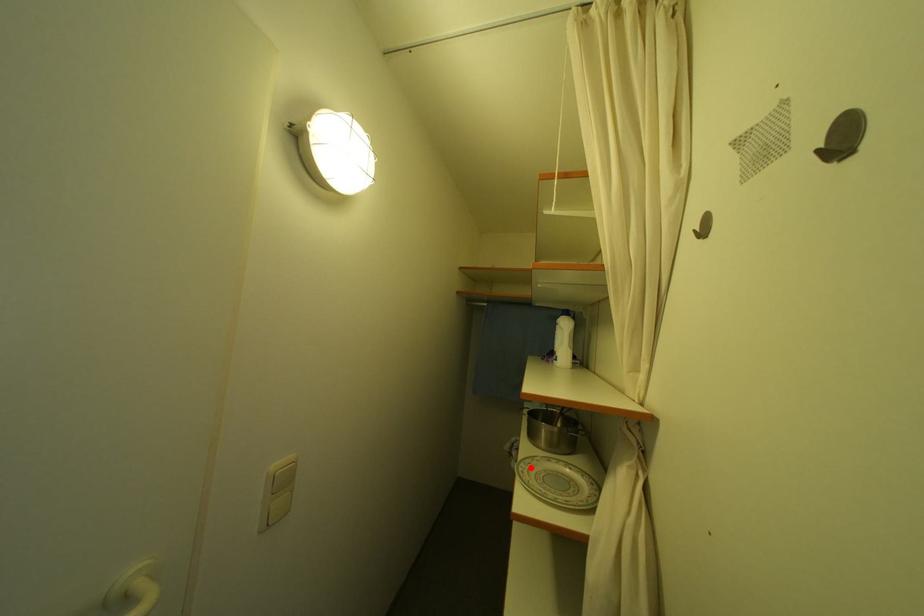
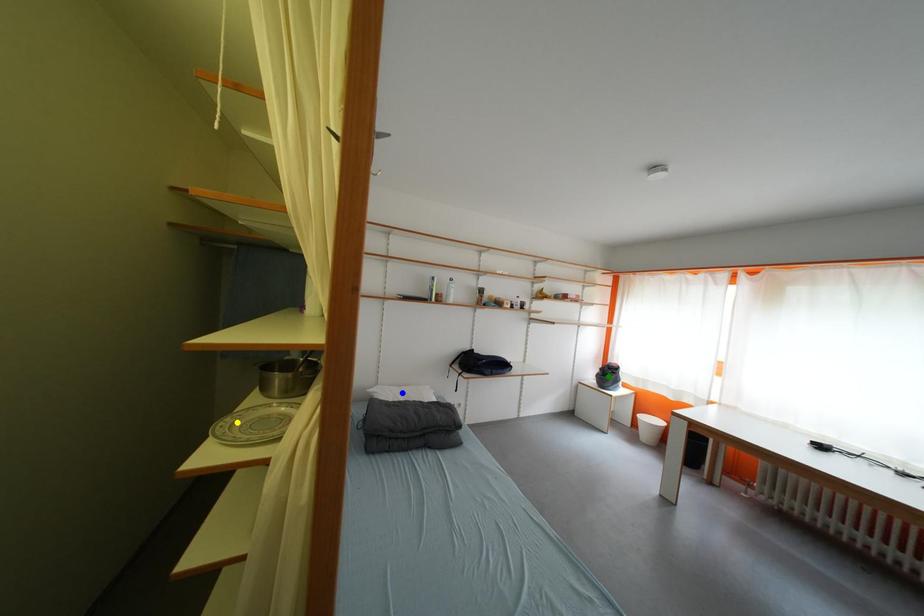
Question: I am providing you with two images of the same scene from different viewpoints. A red point is marked on the first image. You are given multiple points on the second image. In image 2, which mark is for the same physical point as the one in image 1?

Choices:
 (A) yellow point
 (B) blue point
 (C) green point

Answer: (A)